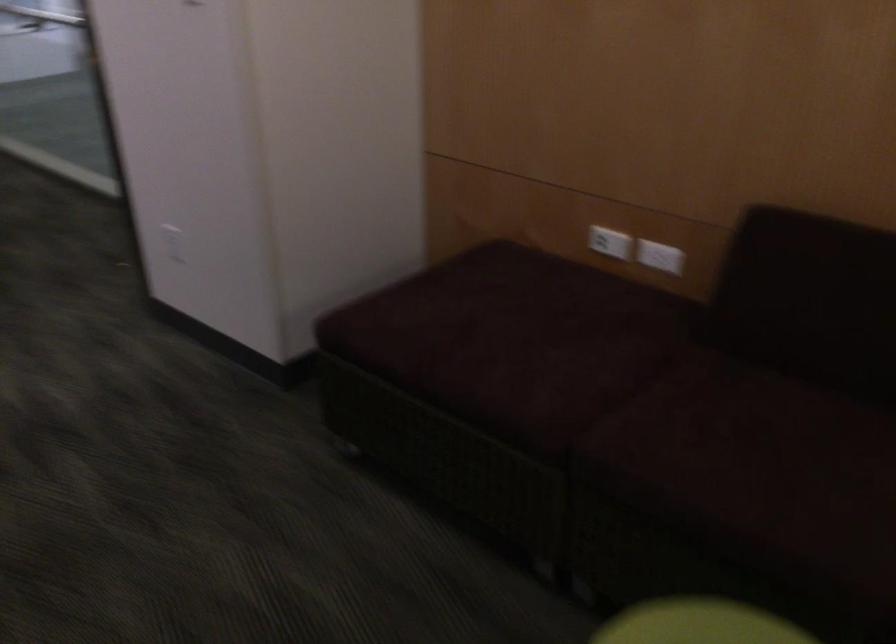
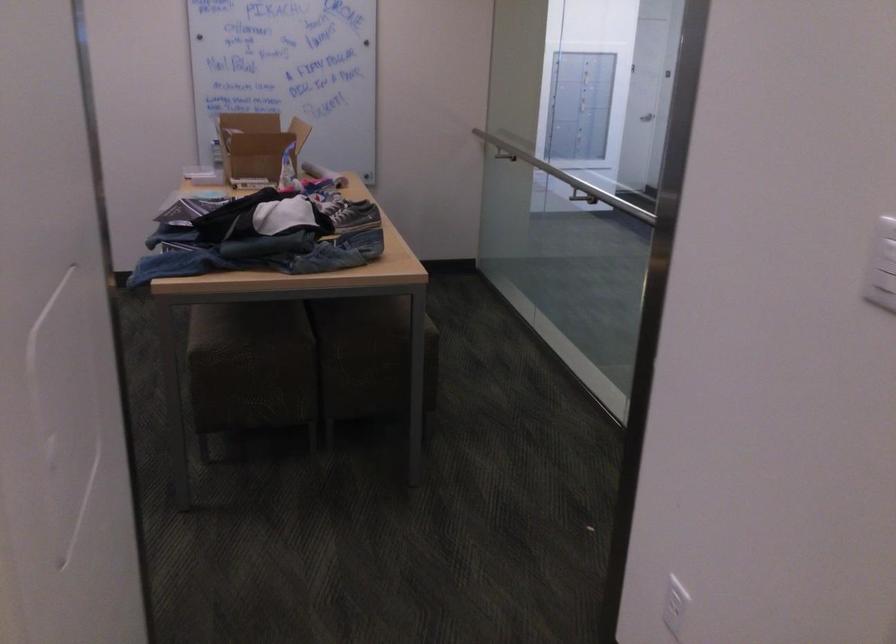
Where in the second image is the point corresponding to the point at 167,237 from the first image?

(675, 605)